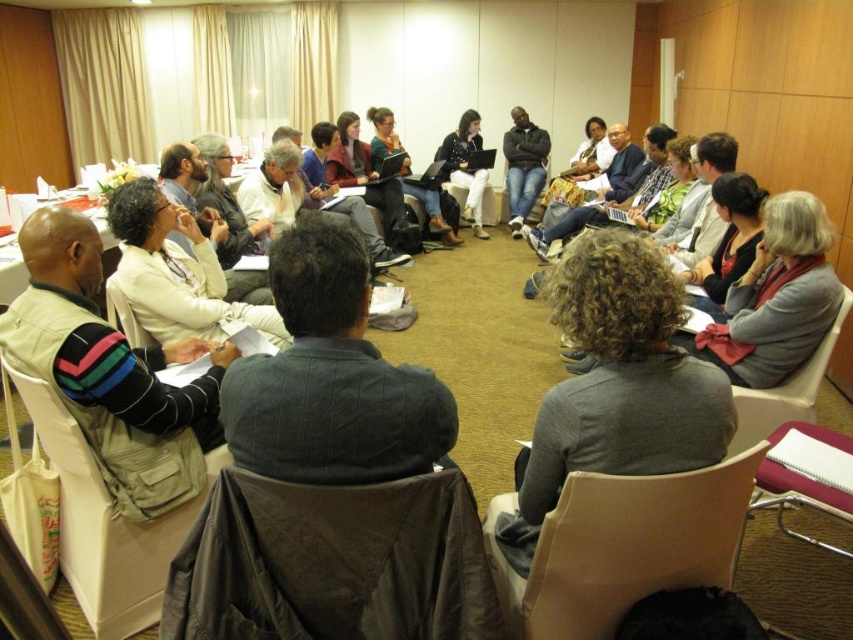
You are a participant in the conference and you are sitting on the khaki fabric chair at lower left. You need to pass a document to the person wearing jeans at center. In which direction should you pass the document?

You should pass the document to your right, as the jeans at center is located to the right of the khaki fabric chair at lower left.

You are organizing a small group discussion and need to seat two participants. You have a brown fabric chair at lower center and a gray sweater at center. Which chair can accommodate a larger person comfortably?

The brown fabric chair at lower center can accommodate a larger person comfortably since its width surpasses that of the gray sweater at center.

Based on the scene description, where is the khaki fabric chair at lower left located in terms of its 2D coordinates?

The khaki fabric chair at lower left is located at the 2D coordinates point (x=105, y=524).